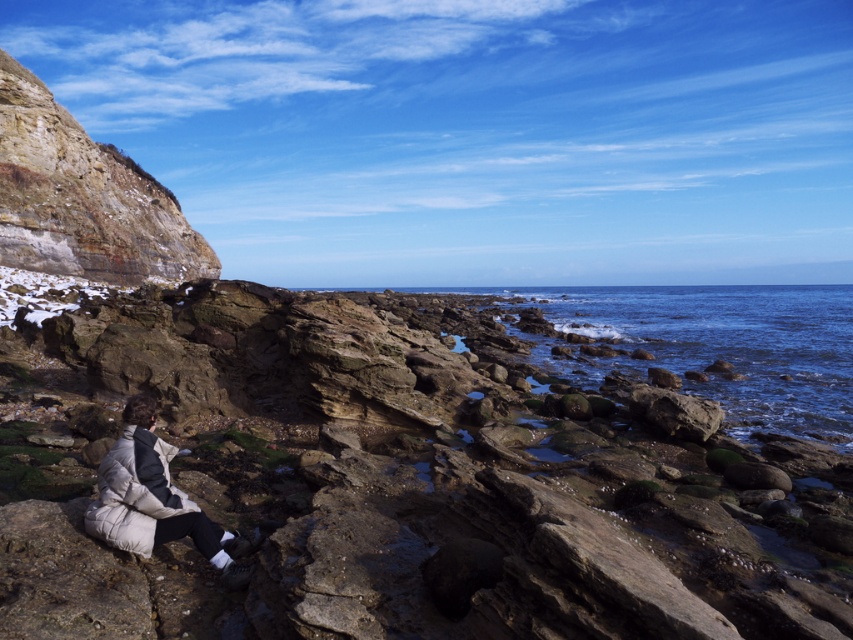
Looking at this image, you are standing on the rocky shore and want to take a photo of the white puffy jacket at lower left without the rustic stone cliff at upper left blocking the view. Is it possible to do so?

The white puffy jacket at lower left is behind the rustic stone cliff at upper left, so you cannot take a photo of it without the cliff blocking the view unless you move to a different position where the cliff is not in front of the jacket.

You are a photographer planning to capture a landscape shot of the rustic stone cliff at upper left and the white puffy jacket at lower left. Which object should you focus on first if you want to include both in the frame without moving the camera?

You should focus on the rustic stone cliff at upper left first because it is taller than the white puffy jacket at lower left, allowing you to frame both by adjusting the camera angle to include the lower object while keeping the taller one in view.

You are standing at the center of the image and want to reach the rustic stone cliff at upper left. Which direction should you move in?

You should move towards the upper left direction to reach the rustic stone cliff at upper left as it is located at point [82,198] in the image.